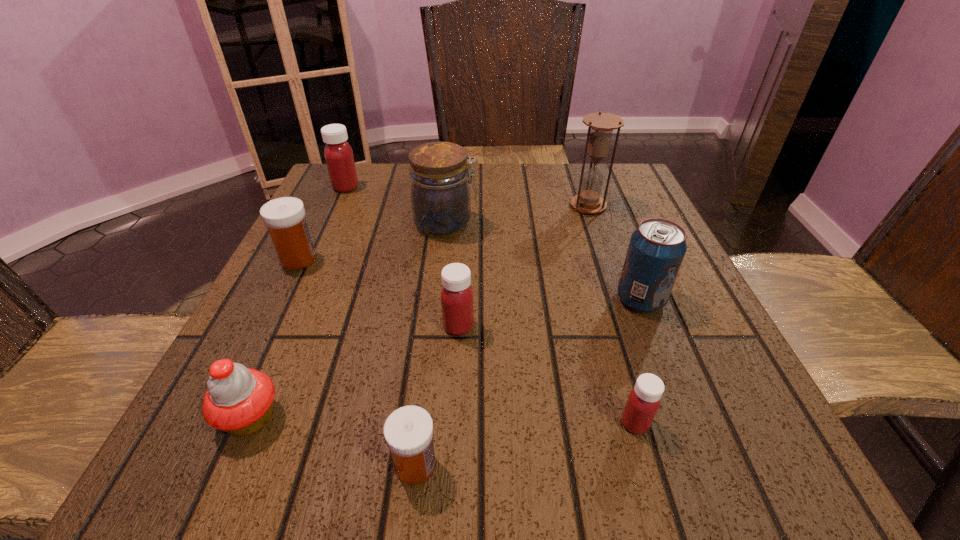
Where is `free point between the pop soda and the tallest medicine`? Image resolution: width=960 pixels, height=540 pixels. free point between the pop soda and the tallest medicine is located at coordinates (493, 244).

The image size is (960, 540). I want to click on free spot between the second nearest medicine and the tallest medicine, so click(491, 305).

Locate an element on the screen. This screenshot has height=540, width=960. vacant space in between the nearest medicine and the pop soda is located at coordinates tap(528, 382).

Locate an element on the screen. The width and height of the screenshot is (960, 540). free space between the pop soda and the red cupcake is located at coordinates pos(445,359).

Find the location of a particular element. The height and width of the screenshot is (540, 960). empty space that is in between the rightmost medicine and the right white medicine is located at coordinates pos(525,444).

The width and height of the screenshot is (960, 540). What are the coordinates of `free space between the nearest red medicine and the pop soda` in the screenshot? It's located at (637, 362).

What are the coordinates of `vacant region between the second smallest red medicine and the left white medicine` in the screenshot? It's located at (378, 293).

Identify the location of free space that is in between the second nearest red medicine and the nearest red medicine. The image size is (960, 540). (546, 375).

Find the location of a particular element. object that stands as the seventh closest to the brown hourglass is located at coordinates (408, 431).

I want to click on the sixth closest object relative to the left white medicine, so point(601,125).